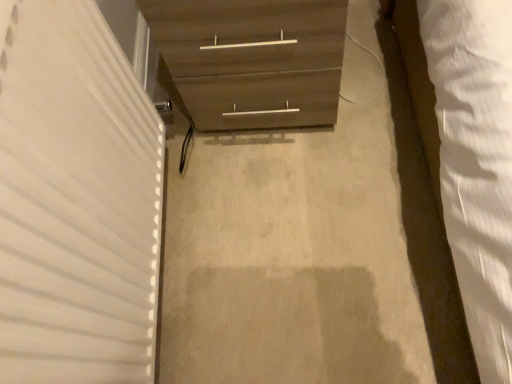
Where is `wooden chest of drawers at center`? The width and height of the screenshot is (512, 384). wooden chest of drawers at center is located at coordinates (252, 59).

Describe the element at coordinates (252, 59) in the screenshot. I see `wooden chest of drawers at center` at that location.

Locate an element on the screen. The width and height of the screenshot is (512, 384). wooden chest of drawers at center is located at coordinates (252, 59).